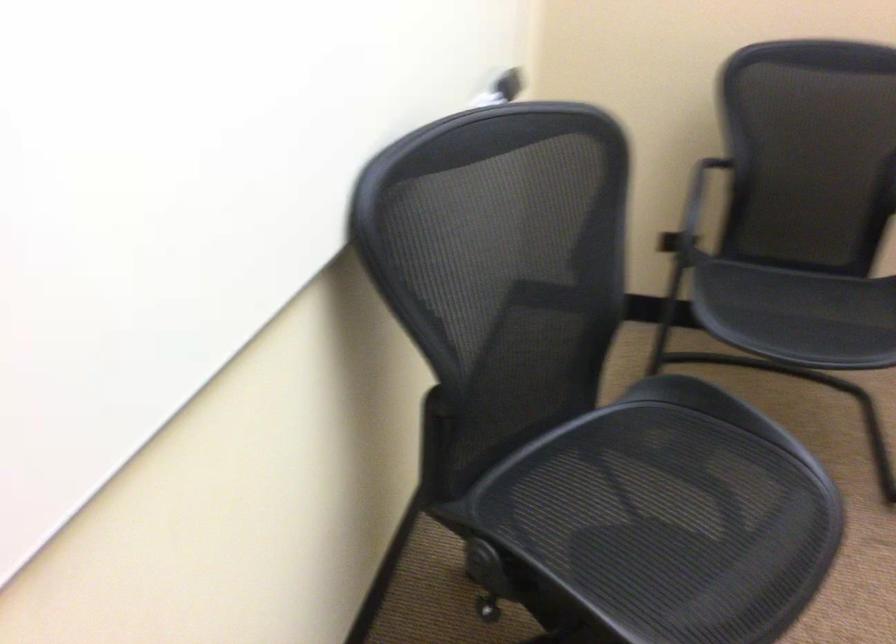
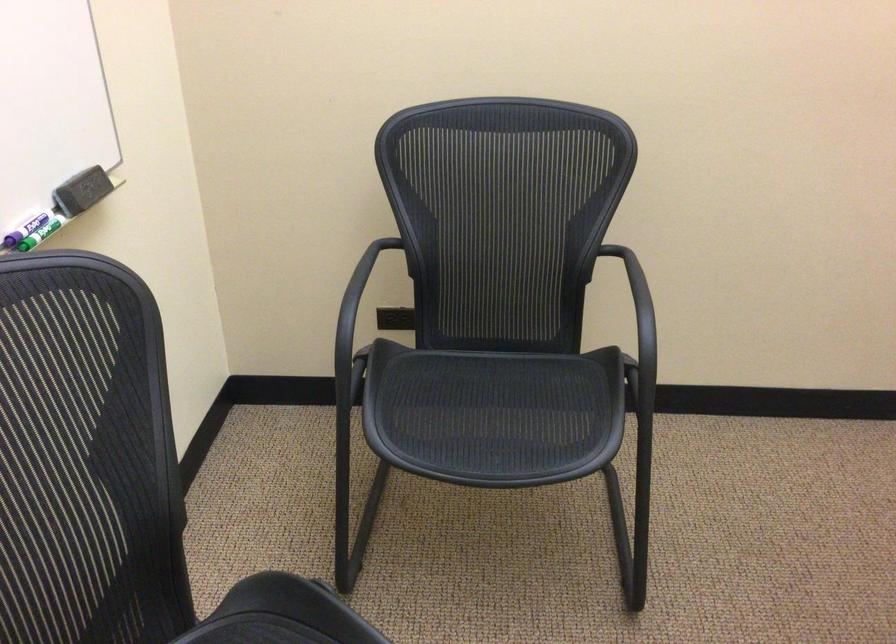
Find the pixel in the second image that matches (x=790, y=297) in the first image.

(478, 413)